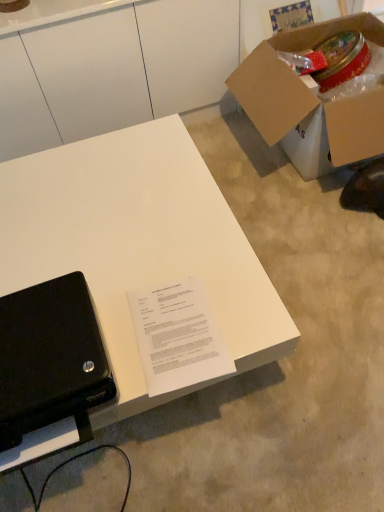
The height and width of the screenshot is (512, 384). Find the location of `free area in between black matte laptop at lower left and white paper at center`. free area in between black matte laptop at lower left and white paper at center is located at coordinates (124, 337).